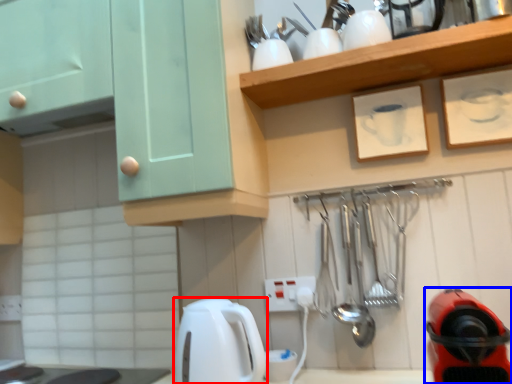
Question: Which of the following is the farthest to the observer, kitchen appliance (highlighted by a red box) or home appliance (highlighted by a blue box)?

Choices:
 (A) kitchen appliance
 (B) home appliance

Answer: (A)